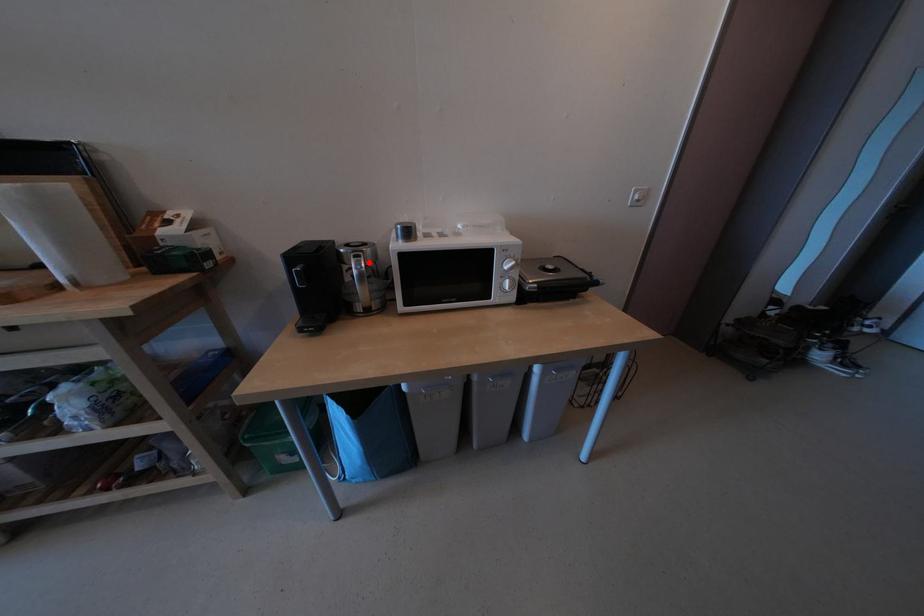
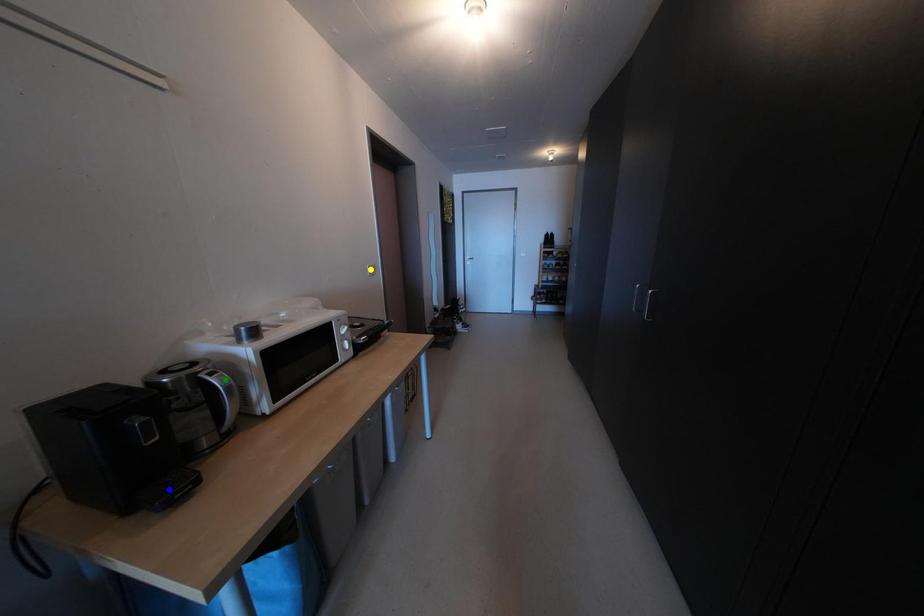
Question: I am providing you with two images of the same scene from different viewpoints. A red point is marked on the first image. You are given multiple points on the second image. In image 2, which mark is for the same physical point as the one in image 1?

Choices:
 (A) green point
 (B) blue point
 (C) yellow point

Answer: (A)